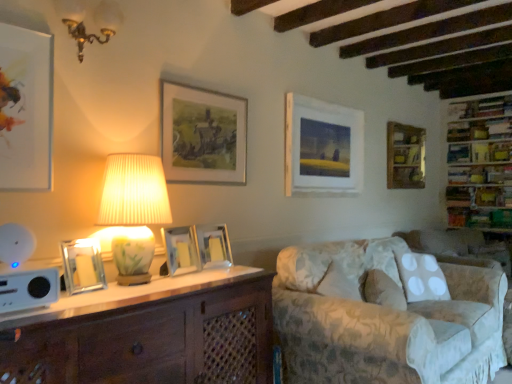
I want to click on vacant area that lies to the right of transparent glass picture frame at left, which appears as the second picture frame when viewed from the front, so click(x=120, y=292).